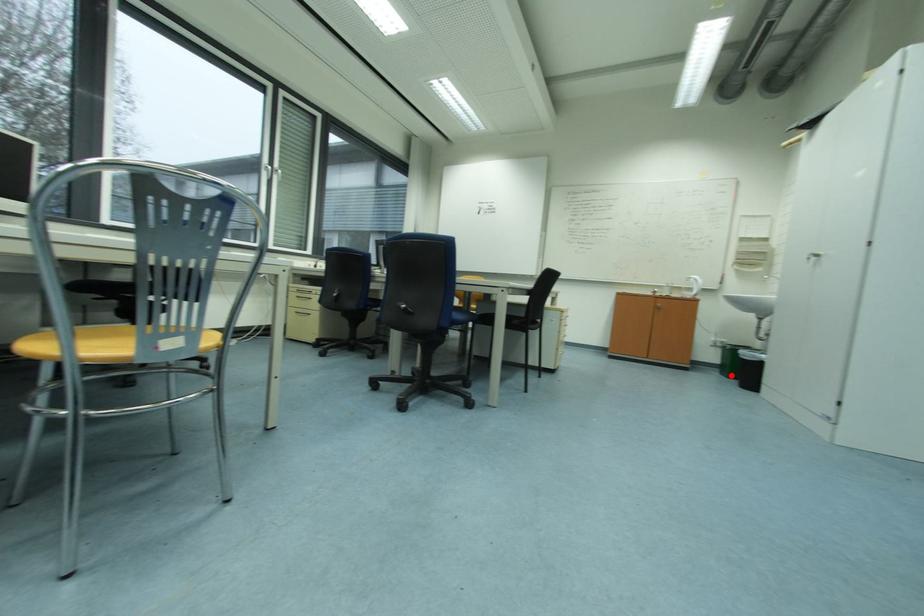
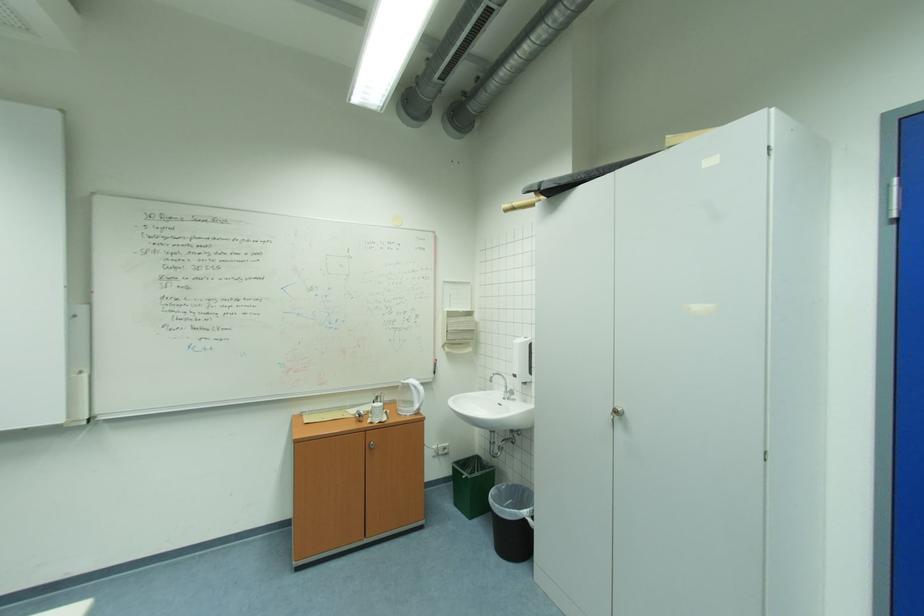
Question: I am providing you with two images of the same scene from different viewpoints. In image1, a red point is highlighted. Considering the same 3D point in image2, which of the following is correct?

Choices:
 (A) It is closer
 (B) It is farther

Answer: (B)